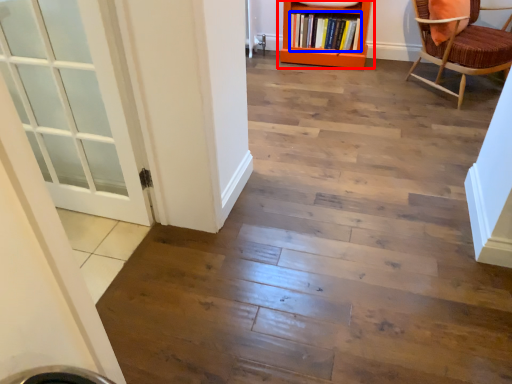
Question: Which object is closer to the camera taking this photo, bookcase (highlighted by a red box) or book (highlighted by a blue box)?

Choices:
 (A) bookcase
 (B) book

Answer: (A)